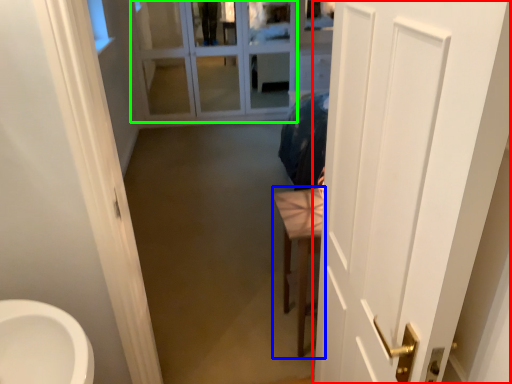
Question: Which object is positioned farthest from door (highlighted by a red box)? Select from furniture (highlighted by a blue box) and glass door (highlighted by a green box).

Choices:
 (A) furniture
 (B) glass door

Answer: (B)